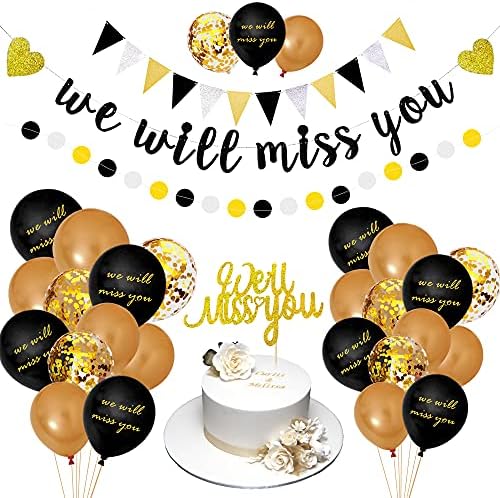
In order to click on cake tray in this screenshot , I will do `click(217, 477)`.